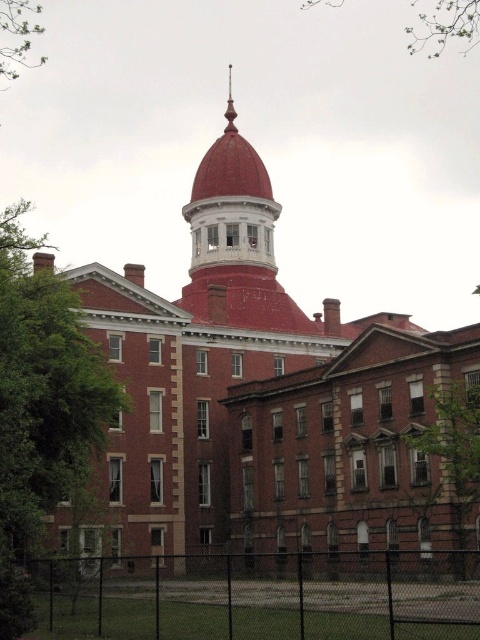
You are standing at the base of the historic brick building with the red dome and white balcony. You want to take a photo that includes both the building and the green leafy tree at lower right. The camera you have can focus on objects up to 40 meters away. Will the tree be in focus if you position yourself to capture the entire building in the frame?

The green leafy tree at lower right is 39.25 meters away from the camera, which is within the camera focus range of up to 40 meters. Therefore, the tree will be in focus when you take the photo.